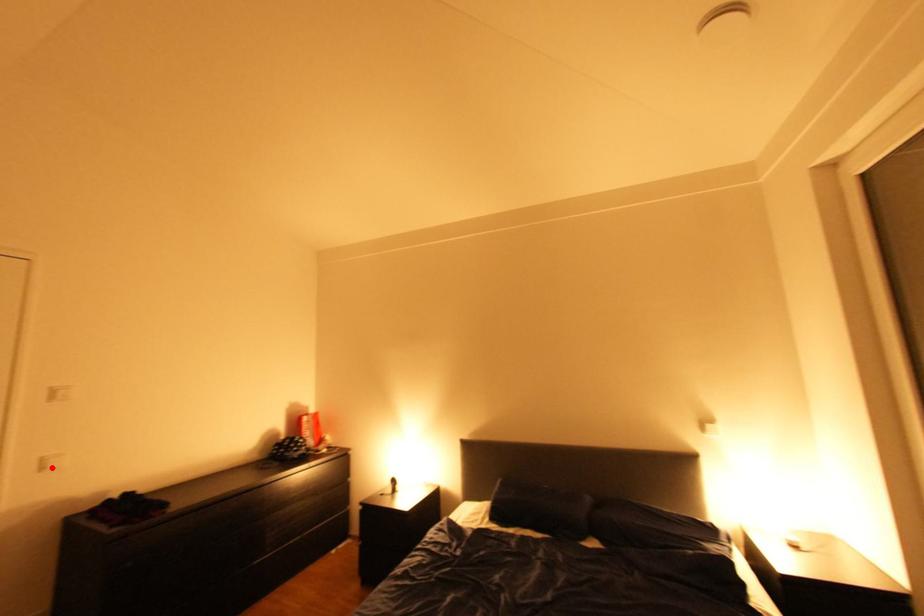
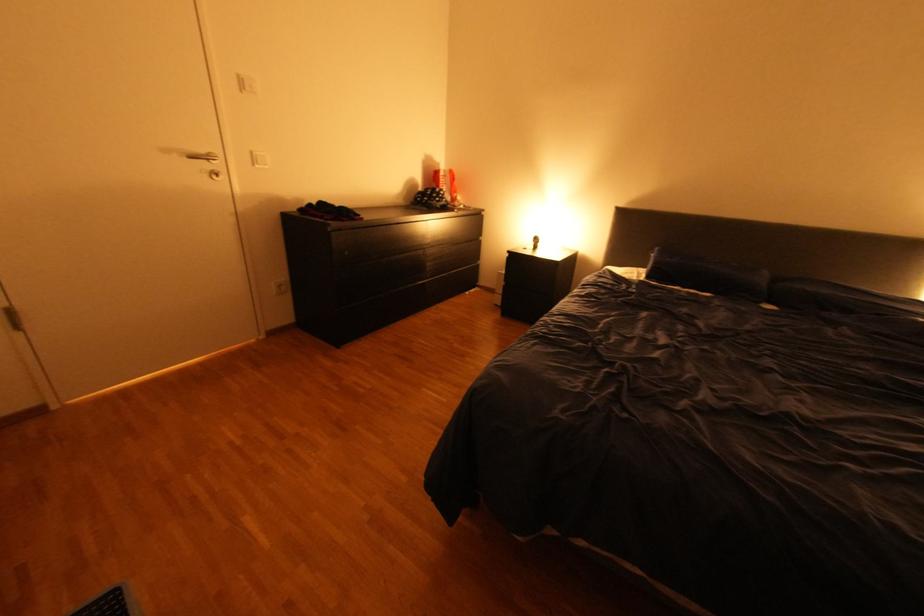
In the second image, find the point that corresponds to the highlighted location in the first image.

(264, 161)